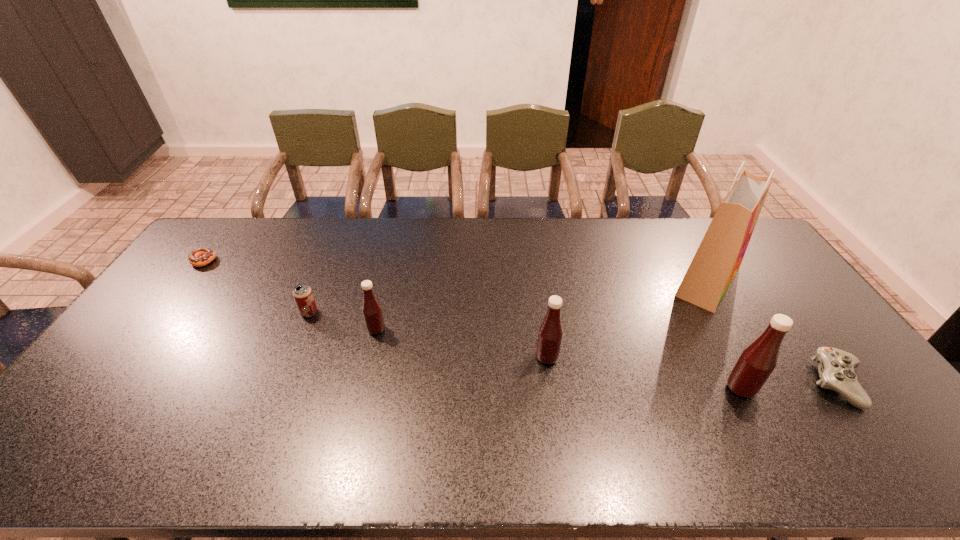
You are a GUI agent. You are given a task and a screenshot of the screen. Output one action in this format:
    pyautogui.click(x=<x>, y=<y>)
    Task: Click on the control
    The image size is (960, 540).
    Given the screenshot: What is the action you would take?
    pyautogui.click(x=836, y=369)

Where is `free space located 0.100m on the left of the fourth nearest object`? The width and height of the screenshot is (960, 540). free space located 0.100m on the left of the fourth nearest object is located at coordinates (334, 330).

Where is `vacant point located 0.090m on the back of the second shortest Tabasco sauce`? vacant point located 0.090m on the back of the second shortest Tabasco sauce is located at coordinates (542, 325).

Identify the location of free space located on the right of the nearest Tabasco sauce. (793, 389).

Where is `vacant position located 0.280m on the front of the doughnut`? The image size is (960, 540). vacant position located 0.280m on the front of the doughnut is located at coordinates (152, 329).

You are a GUI agent. You are given a task and a screenshot of the screen. Output one action in this format:
    pyautogui.click(x=<x>, y=<y>)
    Task: Click on the vacant point located on the front of the beer can
    The image size is (960, 540).
    Given the screenshot: What is the action you would take?
    pyautogui.click(x=299, y=339)

The height and width of the screenshot is (540, 960). I want to click on free space located 0.320m on the front of the tallest object, so click(780, 403).

Identify the location of free space located on the back of the control. (759, 274).

Where is `doughnut at the far edge`? The height and width of the screenshot is (540, 960). doughnut at the far edge is located at coordinates (201, 256).

Where is `shopping bag at the far edge`? This screenshot has width=960, height=540. shopping bag at the far edge is located at coordinates (719, 256).